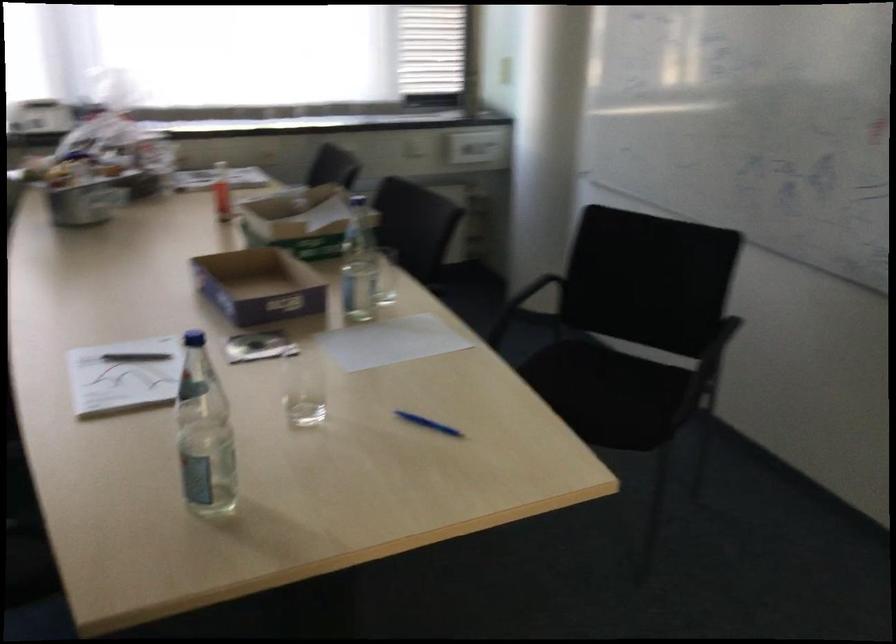
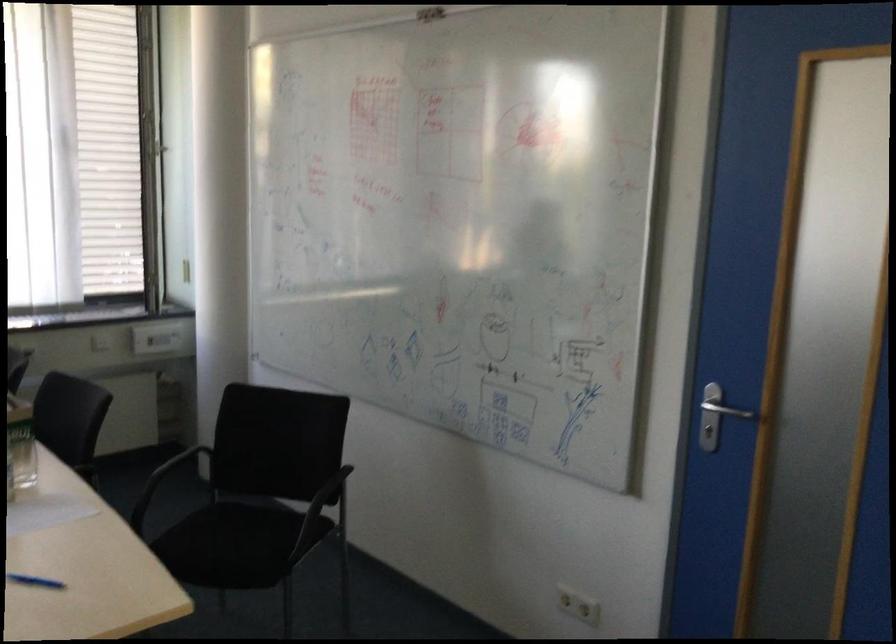
The point at (x=424, y=418) is marked in the first image. Where is the corresponding point in the second image?

(35, 581)